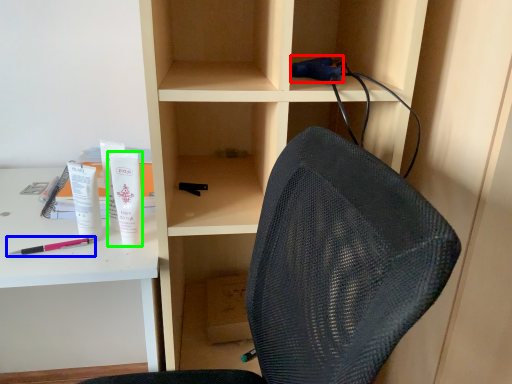
Question: Based on their relative distances, which object is nearer to stationery (highlighted by a red box)? Choose from pencil (highlighted by a blue box) and toiletry (highlighted by a green box).

Choices:
 (A) pencil
 (B) toiletry

Answer: (B)